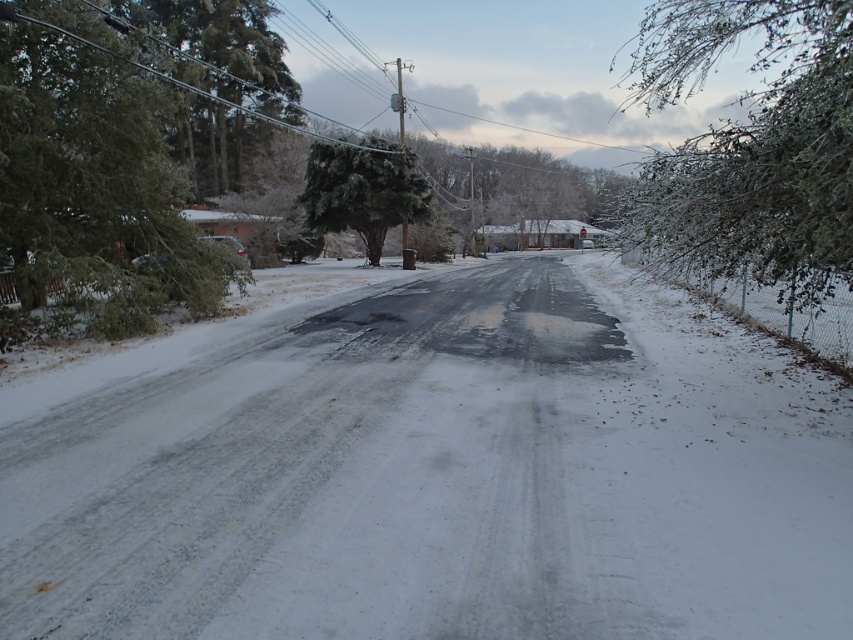
Based on the photo, who is shorter, green frosted tree at left or snow-covered branches at right?

With less height is green frosted tree at left.

Who is higher up, green frosted tree at left or snow-covered branches at right?

Positioned higher is snow-covered branches at right.

What do you see at coordinates (126, 147) in the screenshot? I see `green frosted tree at left` at bounding box center [126, 147].

Find the location of `green frosted tree at left`. green frosted tree at left is located at coordinates click(126, 147).

Can you confirm if white matte snow at center is positioned to the right of green frosted tree at left?

Indeed, white matte snow at center is positioned on the right side of green frosted tree at left.

The width and height of the screenshot is (853, 640). What do you see at coordinates (434, 470) in the screenshot? I see `white matte snow at center` at bounding box center [434, 470].

At what (x,y) coordinates should I click in order to perform the action: click on white matte snow at center. Please return your answer as a coordinate pair (x, y). Looking at the image, I should click on (434, 470).

Is white matte snow at center further to the viewer compared to snow-covered branches at right?

That is False.

Based on the photo, is white matte snow at center wider than snow-covered branches at right?

No, white matte snow at center is not wider than snow-covered branches at right.

Locate an element on the screen. Image resolution: width=853 pixels, height=640 pixels. white matte snow at center is located at coordinates (434, 470).